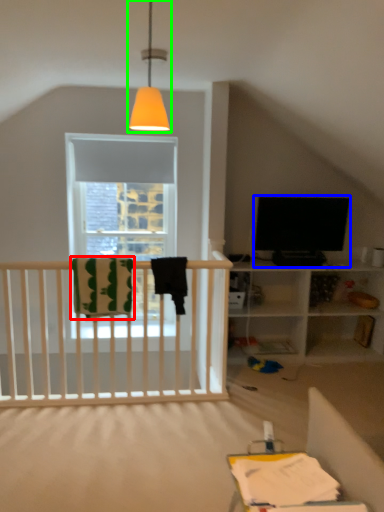
Question: Which is farther away from blanket (highlighted by a red box)? television (highlighted by a blue box) or lamp (highlighted by a green box)?

Choices:
 (A) television
 (B) lamp

Answer: (B)